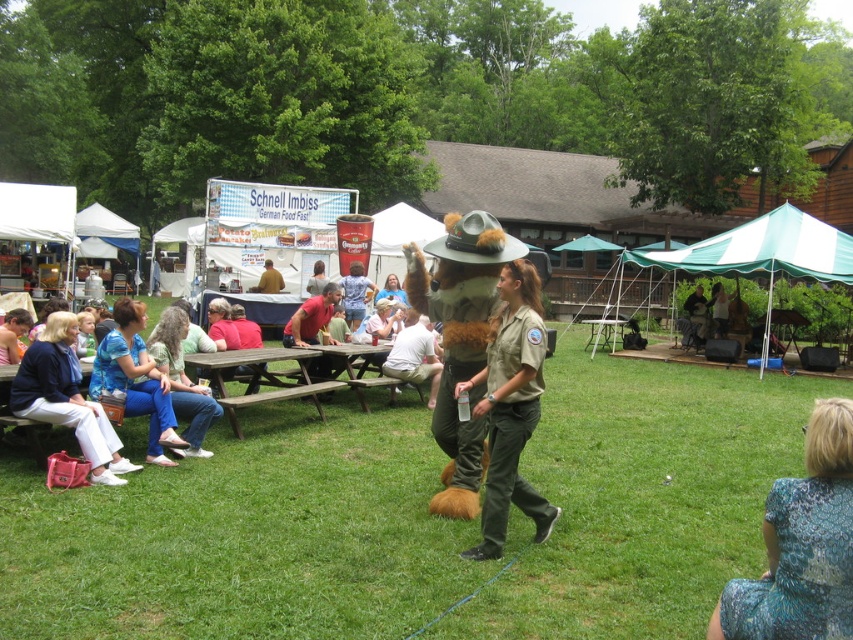
Question: From the image, what is the correct spatial relationship of matte blue shirt at lower left in relation to matte green uniform at center?

Choices:
 (A) below
 (B) above

Answer: (A)

Question: Can you confirm if matte blue shirt at lower left is bigger than matte green uniform at center?

Choices:
 (A) yes
 (B) no

Answer: (A)

Question: Which point is farther from the camera taking this photo?

Choices:
 (A) (22, 332)
 (B) (61, 328)

Answer: (A)

Question: Does matte blue jacket at lower left appear over red cotton shirt at center?

Choices:
 (A) no
 (B) yes

Answer: (A)

Question: Which of the following is the closest to the observer?

Choices:
 (A) green grass at center
 (B) blue lace dress at lower right

Answer: (B)

Question: Which of the following is the farthest from the observer?

Choices:
 (A) (354, 276)
 (B) (13, 333)

Answer: (A)